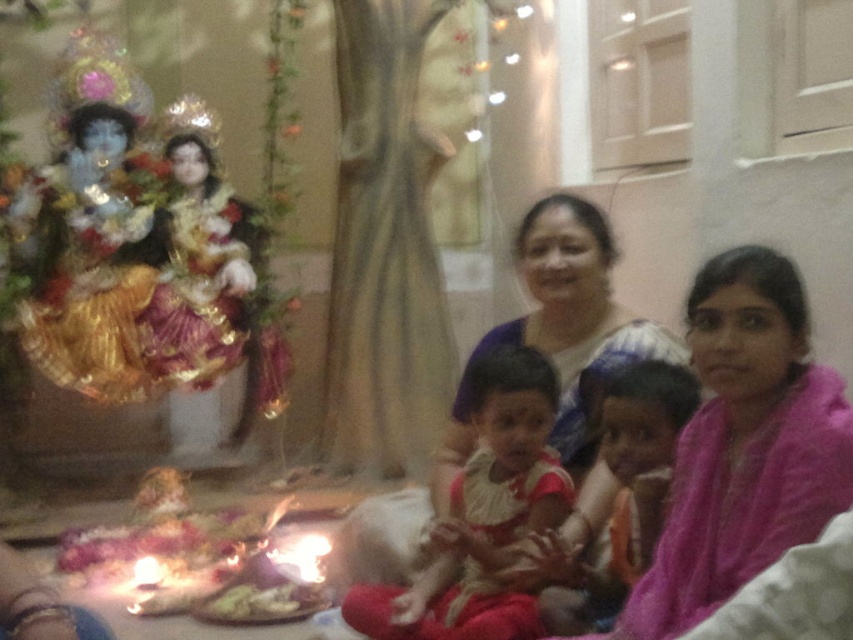
You are a photographer standing in the room. You need to capture a photo of the matte white dress at center without including the altar in the background. Where should you position yourself to ensure the altar is out of frame?

The matte white dress at center is located at point (482, 515). To exclude the altar from the background, position yourself such that the camera is angled away from the altar area, focusing on the coordinates where the dress is placed.

You are a delivery robot with a package that needs to be placed between the two people sitting at the point marked as point (762,461). The minimum distance required for the robot to safely place the package is 1.5 meters. Can you safely place the package there?

The two people sitting at the point marked as point (762,461) are 1.44 meters apart, which is less than the required 1.5 meters. Therefore, the robot cannot safely place the package there.

From the picture: You are a photographer taking a picture of the family gathering. You need to ensure that the pink fabric at center and the matte white dress at center are both visible in the frame. Based on their positions, which one should you focus on first to capture both in the shot?

The pink fabric at center is positioned on the right side of the matte white dress at center. To capture both in the frame, focus on the matte white dress at center first as it is on the left, ensuring the pink fabric at center remains within the right side of the frame.